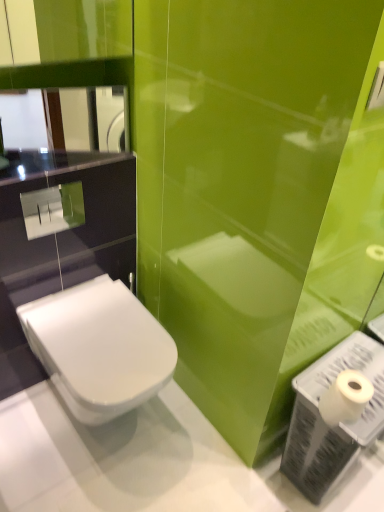
The width and height of the screenshot is (384, 512). Describe the element at coordinates (345, 398) in the screenshot. I see `white matte toilet paper at lower right` at that location.

This screenshot has height=512, width=384. Identify the location of white plastic toilet paper at lower right. (338, 424).

Which is closer to the camera, (357, 378) or (314, 499)?

Point (357, 378).

From the image's perspective, does white matte toilet paper at lower right appear higher than white plastic toilet paper at lower right?

Yes, from the image's perspective, white matte toilet paper at lower right is over white plastic toilet paper at lower right.

From a real-world perspective, is white matte toilet paper at lower right above or below white plastic toilet paper at lower right?

white matte toilet paper at lower right is situated higher than white plastic toilet paper at lower right in the real world.

Are glossy glass mirror at upper left and white plastic toilet paper at lower right beside each other?

No, glossy glass mirror at upper left is not in contact with white plastic toilet paper at lower right.

Is glossy glass mirror at upper left not within white plastic toilet paper at lower right?

That's correct, glossy glass mirror at upper left is outside of white plastic toilet paper at lower right.

Considering the sizes of objects glossy glass mirror at upper left and white plastic toilet paper at lower right in the image provided, who is wider, glossy glass mirror at upper left or white plastic toilet paper at lower right?

Wider between the two is white plastic toilet paper at lower right.

Which is more to the left, glossy glass mirror at upper left or white plastic toilet paper at lower right?

From the viewer's perspective, glossy glass mirror at upper left appears more on the left side.

Can you confirm if white plastic toilet paper at lower right is shorter than white glossy toilet at lower left?

No.

Looking at this image, how much distance is there between white plastic toilet paper at lower right and white glossy toilet at lower left?

white plastic toilet paper at lower right and white glossy toilet at lower left are 60.59 centimeters apart from each other.

Is white glossy toilet at lower left completely or partially inside white plastic toilet paper at lower right?

No, white plastic toilet paper at lower right does not contain white glossy toilet at lower left.

Which is more to the right, white plastic toilet paper at lower right or white glossy toilet at lower left?

white plastic toilet paper at lower right.

Is glossy glass mirror at upper left beside white glossy toilet at lower left?

No, glossy glass mirror at upper left is not making contact with white glossy toilet at lower left.

Considering the points (56, 129) and (128, 294), which point is in front, point (56, 129) or point (128, 294)?

The point (128, 294) is closer.

Does glossy glass mirror at upper left have a larger size compared to white glossy toilet at lower left?

No, glossy glass mirror at upper left is not bigger than white glossy toilet at lower left.

Considering the positions of objects white glossy toilet at lower left and white plastic toilet paper at lower right in the image provided, who is more to the right, white glossy toilet at lower left or white plastic toilet paper at lower right?

white plastic toilet paper at lower right.

From a real-world perspective, is white glossy toilet at lower left above or below white plastic toilet paper at lower right?

white glossy toilet at lower left is situated higher than white plastic toilet paper at lower right in the real world.

From the image's perspective, is white glossy toilet at lower left located above or below white plastic toilet paper at lower right?

white glossy toilet at lower left is situated higher than white plastic toilet paper at lower right in the image.

Which is closer to the camera, (375, 366) or (39, 153)?

A: The point (375, 366) is closer to the camera.

From the picture: Is white plastic toilet paper at lower right with glossy glass mirror at upper left?

No, white plastic toilet paper at lower right is not beside glossy glass mirror at upper left.

Is glossy glass mirror at upper left surrounded by white plastic toilet paper at lower right?

That's incorrect, glossy glass mirror at upper left is not inside white plastic toilet paper at lower right.

From the image's perspective, is white glossy toilet at lower left located beneath white matte toilet paper at lower right?

No.

In the scene shown: Can white matte toilet paper at lower right be found inside white glossy toilet at lower left?

Actually, white matte toilet paper at lower right is outside white glossy toilet at lower left.

From a real-world perspective, is white glossy toilet at lower left physically located above or below white matte toilet paper at lower right?

white glossy toilet at lower left is situated lower than white matte toilet paper at lower right in the real world.

Could you tell me if white glossy toilet at lower left is turned towards white matte toilet paper at lower right?

No.

Identify the location of toilet paper that is on the left side of white plastic toilet paper at lower right. The image size is (384, 512). click(345, 398).

In order to click on mirror behind the white plastic toilet paper at lower right in this screenshot , I will do `click(73, 139)`.

Consider the image. Looking at the image, which one is located further to white matte toilet paper at lower right, white plastic toilet paper at lower right or glossy glass mirror at upper left?

Based on the image, glossy glass mirror at upper left appears to be further to white matte toilet paper at lower right.

From the picture: Based on their spatial positions, is white plastic toilet paper at lower right or white glossy toilet at lower left further from white matte toilet paper at lower right?

Based on the image, white glossy toilet at lower left appears to be further to white matte toilet paper at lower right.

Which object lies further to the anchor point white glossy toilet at lower left, white plastic toilet paper at lower right or white matte toilet paper at lower right?

white matte toilet paper at lower right.

Looking at the image, which one is located closer to white glossy toilet at lower left, white matte toilet paper at lower right or glossy glass mirror at upper left?

A: white matte toilet paper at lower right is positioned closer to the anchor white glossy toilet at lower left.

Estimate the real-world distances between objects in this image. Which object is closer to white matte toilet paper at lower right, white glossy toilet at lower left or glossy glass mirror at upper left?

The object closer to white matte toilet paper at lower right is white glossy toilet at lower left.

Considering their positions, is white matte toilet paper at lower right positioned further to white plastic toilet paper at lower right than white glossy toilet at lower left?

Based on the image, white glossy toilet at lower left appears to be further to white plastic toilet paper at lower right.

When comparing their distances from white plastic toilet paper at lower right, does white glossy toilet at lower left or glossy glass mirror at upper left seem further?

glossy glass mirror at upper left.

Based on their spatial positions, is white matte toilet paper at lower right or white glossy toilet at lower left closer to glossy glass mirror at upper left?

white glossy toilet at lower left is closer to glossy glass mirror at upper left.

At what (x,y) coordinates should I click in order to perform the action: click on toilet between glossy glass mirror at upper left and white plastic toilet paper at lower right vertically. Please return your answer as a coordinate pair (x, y). Looking at the image, I should click on tap(99, 348).

Identify the location of toilet paper located between white glossy toilet at lower left and white plastic toilet paper at lower right in the left-right direction. This screenshot has height=512, width=384. (345, 398).

At what (x,y) coordinates should I click in order to perform the action: click on toilet paper between glossy glass mirror at upper left and white plastic toilet paper at lower right in the vertical direction. Please return your answer as a coordinate pair (x, y). Looking at the image, I should click on (345, 398).

The image size is (384, 512). I want to click on toilet between glossy glass mirror at upper left and white matte toilet paper at lower right from top to bottom, so click(x=99, y=348).